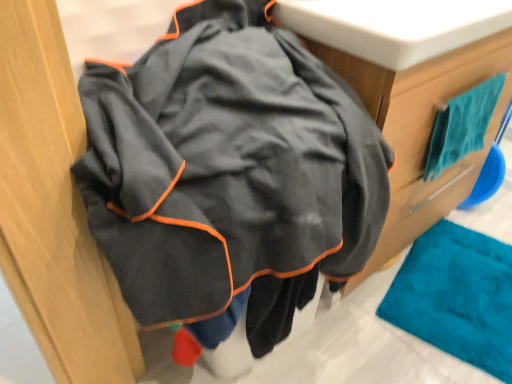
Question: Does teal fabric towel at upper right have a smaller size compared to teal fabric towel at upper right?

Choices:
 (A) no
 (B) yes

Answer: (B)

Question: Is teal fabric towel at upper right at the back of teal fabric towel at upper right?

Choices:
 (A) no
 (B) yes

Answer: (B)

Question: Is the depth of teal fabric towel at upper right greater than that of teal fabric towel at upper right?

Choices:
 (A) no
 (B) yes

Answer: (B)

Question: Is teal fabric towel at upper right facing towards teal fabric towel at upper right?

Choices:
 (A) no
 (B) yes

Answer: (A)

Question: Considering the relative sizes of teal fabric towel at upper right and teal fabric towel at upper right in the image provided, is teal fabric towel at upper right taller than teal fabric towel at upper right?

Choices:
 (A) no
 (B) yes

Answer: (A)

Question: From a real-world perspective, is teal fabric towel at upper right physically below teal fabric towel at upper right?

Choices:
 (A) no
 (B) yes

Answer: (A)

Question: Can you confirm if teal fabric towel at upper right is shorter than teal fabric towel at upper right?

Choices:
 (A) yes
 (B) no

Answer: (B)

Question: Can you confirm if teal fabric towel at upper right is thinner than teal fabric towel at upper right?

Choices:
 (A) yes
 (B) no

Answer: (B)

Question: Is teal fabric towel at upper right with teal fabric towel at upper right?

Choices:
 (A) no
 (B) yes

Answer: (A)

Question: Is teal fabric towel at upper right wider than teal fabric towel at upper right?

Choices:
 (A) yes
 (B) no

Answer: (A)

Question: Is teal fabric towel at upper right surrounding teal fabric towel at upper right?

Choices:
 (A) yes
 (B) no

Answer: (B)

Question: Is the position of teal fabric towel at upper right more distant than that of teal fabric towel at upper right?

Choices:
 (A) yes
 (B) no

Answer: (B)

Question: Considering the positions of teal fabric towel at upper right and teal fabric towel at upper right in the image, is teal fabric towel at upper right taller or shorter than teal fabric towel at upper right?

Choices:
 (A) short
 (B) tall

Answer: (A)